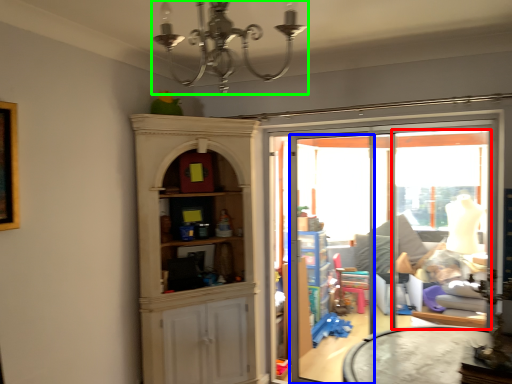
Question: Considering the real-world distances, which object is farthest from window (highlighted by a red box)? screen door (highlighted by a blue box) or light fixture (highlighted by a green box)?

Choices:
 (A) screen door
 (B) light fixture

Answer: (B)